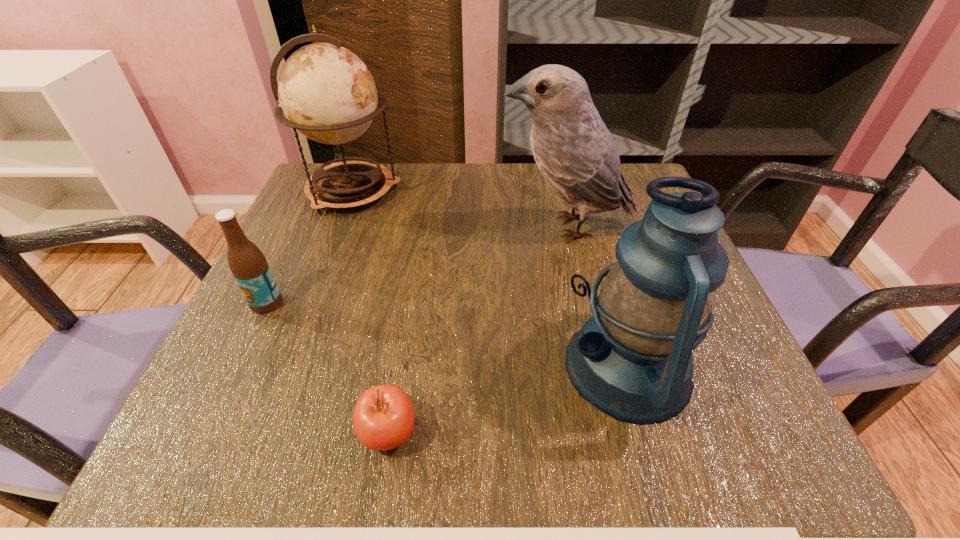
This screenshot has width=960, height=540. I want to click on globe, so click(x=327, y=93).

I want to click on parrot, so click(575, 152).

Identify the location of lantern. (632, 359).

Locate an element on the screen. The height and width of the screenshot is (540, 960). the fourth tallest object is located at coordinates (247, 263).

What are the coordinates of `apple` in the screenshot? It's located at (383, 418).

Find the location of a particular element. The image size is (960, 540). the third object from left to right is located at coordinates (383, 418).

Locate an element on the screen. The image size is (960, 540). free location located at the center of the globe is located at coordinates (524, 191).

Identify the location of vacant position located 0.230m on the front-facing side of the parrot. (396, 227).

At what (x,y) coordinates should I click in order to perform the action: click on free space located 0.100m on the front-facing side of the parrot. Please return your answer as a coordinate pair (x, y). This screenshot has width=960, height=540. Looking at the image, I should click on (454, 227).

Locate an element on the screen. vacant position located 0.090m on the front-facing side of the parrot is located at coordinates (458, 227).